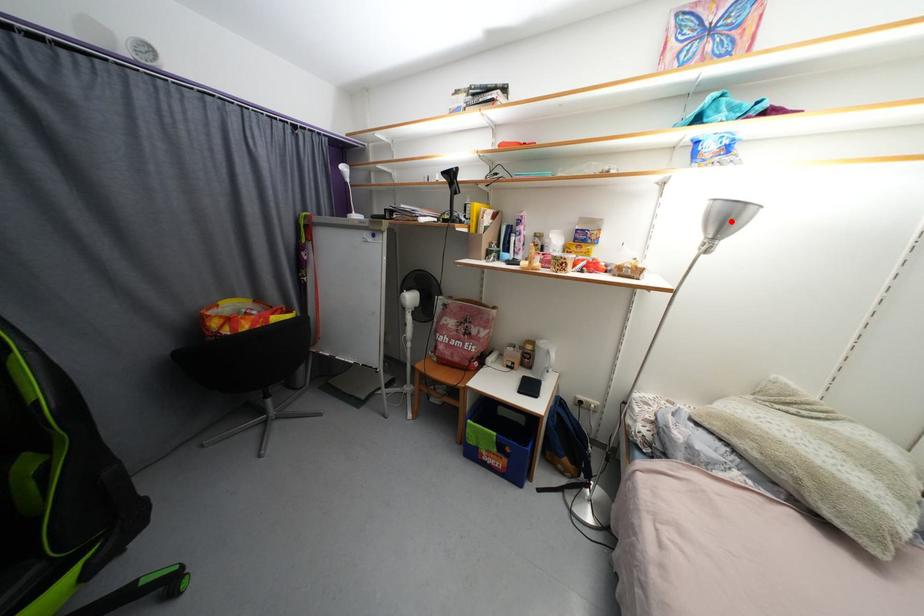
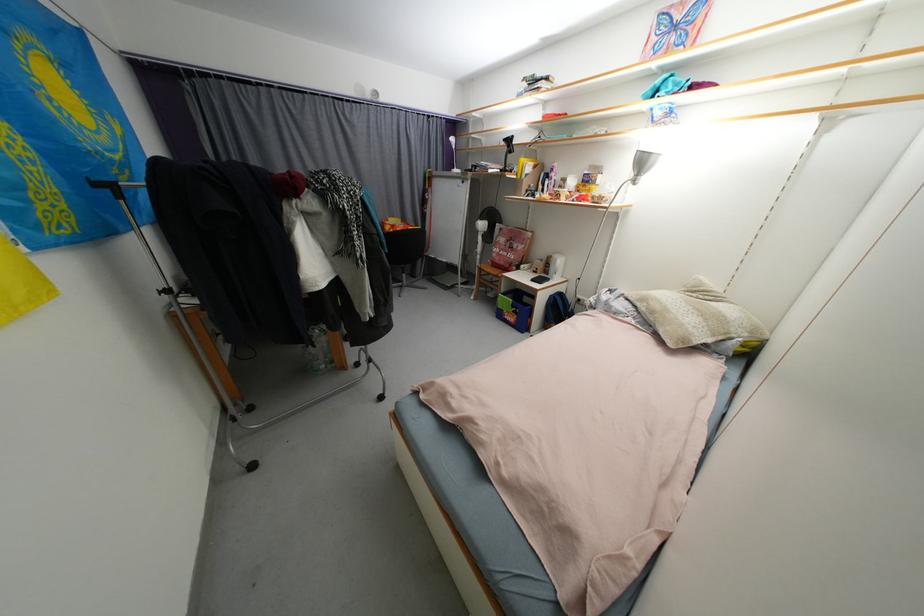
In the second image, find the point that corresponds to the highlighted location in the first image.

(648, 164)